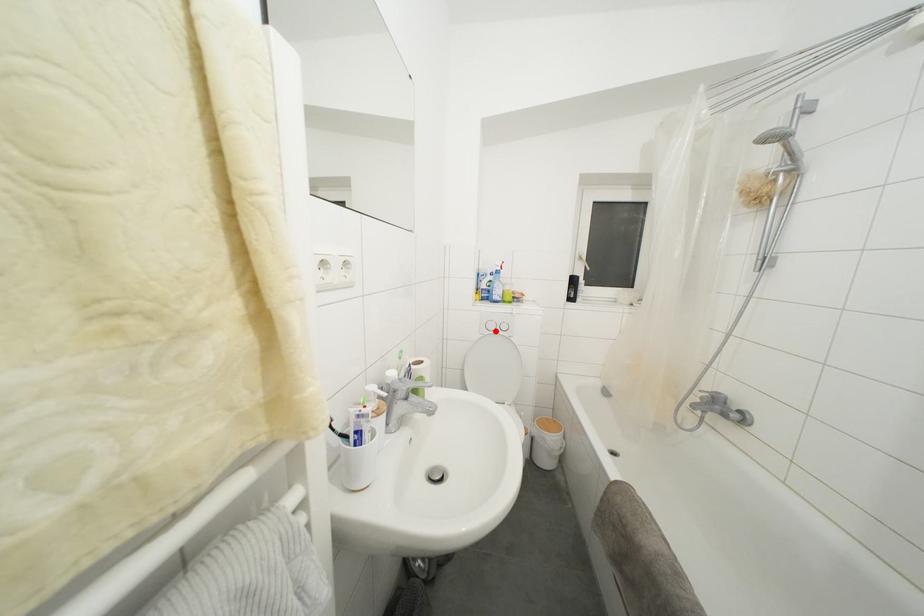
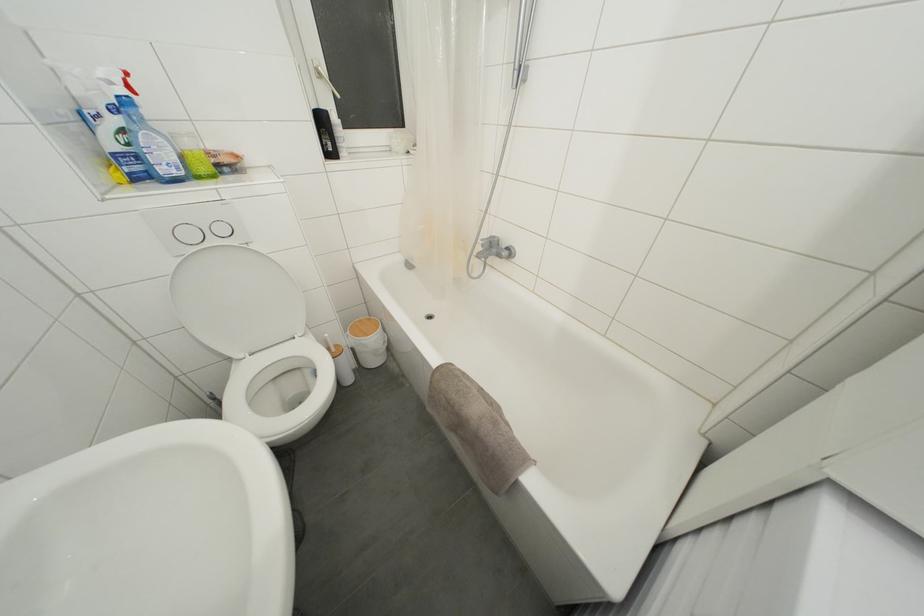
In the second image, find the point that corresponds to the highlighted location in the first image.

(195, 240)